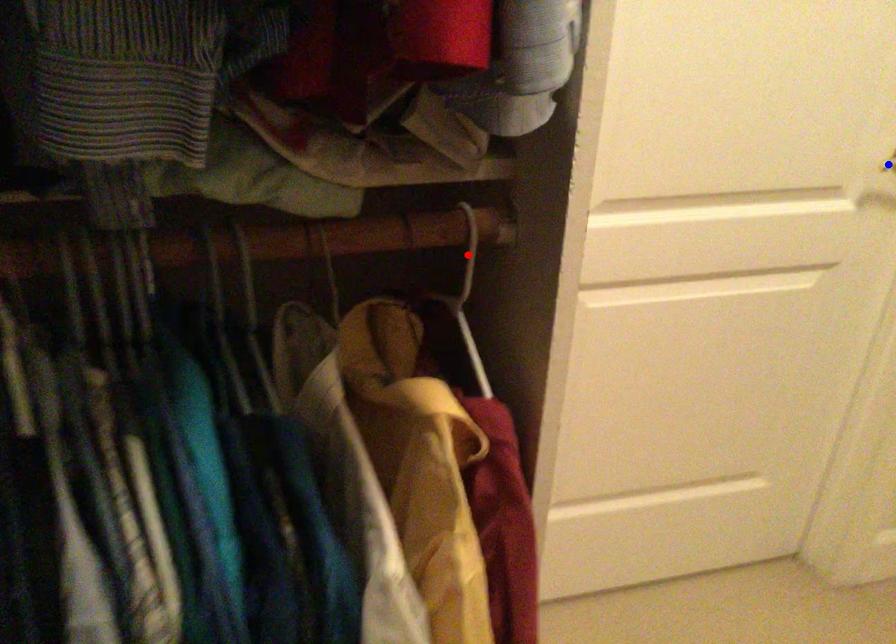
Question: In the image, two points are highlighted. Which point is nearer to the camera? Reply with the corresponding letter.

Choices:
 (A) blue point
 (B) red point

Answer: (B)